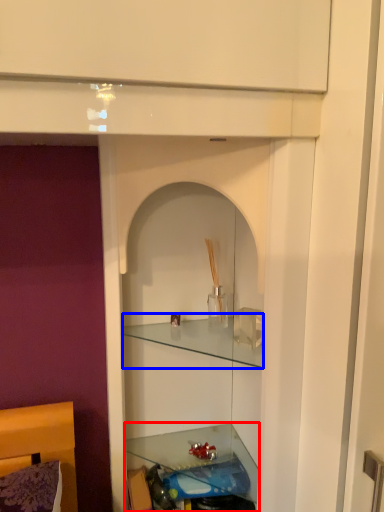
Question: Which point is further to the camera, shelf (highlighted by a red box) or cabinet (highlighted by a blue box)?

Choices:
 (A) shelf
 (B) cabinet

Answer: (A)